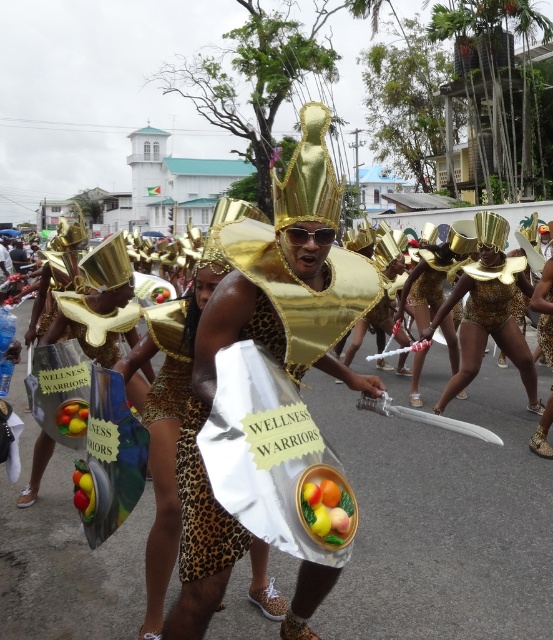
Consider the image. Between gold leopard print dress at center and shiny plastic fruit at center, which one has less height?

With less height is shiny plastic fruit at center.

Does gold leopard print dress at center appear on the right side of shiny plastic fruit at center?

Yes, gold leopard print dress at center is to the right of shiny plastic fruit at center.

Is point (491, 276) closer to viewer compared to point (58, 408)?

No, (491, 276) is behind (58, 408).

Identify the location of gold leopard print dress at center. (492, 292).

Is smooth plastic fruit basket at center bigger than gold leopard print dress at center?

Incorrect, smooth plastic fruit basket at center is not larger than gold leopard print dress at center.

Between smooth plastic fruit basket at center and gold leopard print dress at center, which one has less height?

With less height is smooth plastic fruit basket at center.

Which is in front, point (327, 522) or point (472, 262)?

Point (327, 522)

Find the location of `smooth plastic fruit basket at center`. smooth plastic fruit basket at center is located at coordinates (327, 509).

Between point (200, 557) and point (346, 483), which one is positioned behind?

Positioned behind is point (200, 557).

Who is positioned more to the right, gold leopard print costume at center or smooth plastic fruit basket at center?

smooth plastic fruit basket at center is more to the right.

At what (x,y) coordinates should I click in order to perform the action: click on gold leopard print costume at center. Please return your answer as a coordinate pair (x, y). This screenshot has width=553, height=640. Looking at the image, I should click on (267, 344).

Identify the location of gold leopard print costume at center. The image size is (553, 640). [x=267, y=344].